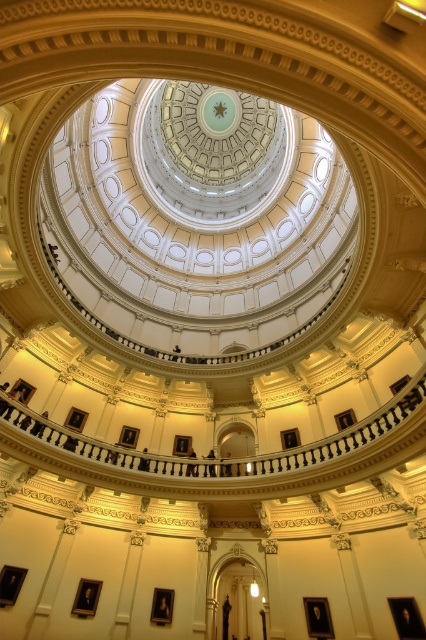
You are an architect evaluating the structural integrity of the white marble dome at center and the white marble balustrade at center. Which of these two objects is taller?

The white marble dome at center is taller than the white marble balustrade at center according to the description.

You are an architect inspecting the grand rotunda. You notice the white marble dome at center and the white marble balustrade at center. Which one is positioned higher in the image?

The white marble dome at center is located above the white marble balustrade at center, so the dome is higher.

You are standing in the grand rotunda and want to take a photo. You have two points marked in your camera viewfinder at coordinates point [293,266] and point [351,433]. Which point will appear closer to the front of the image?

Point [293,266] is further to the camera than point [351,433], so it will appear closer to the front of the image.